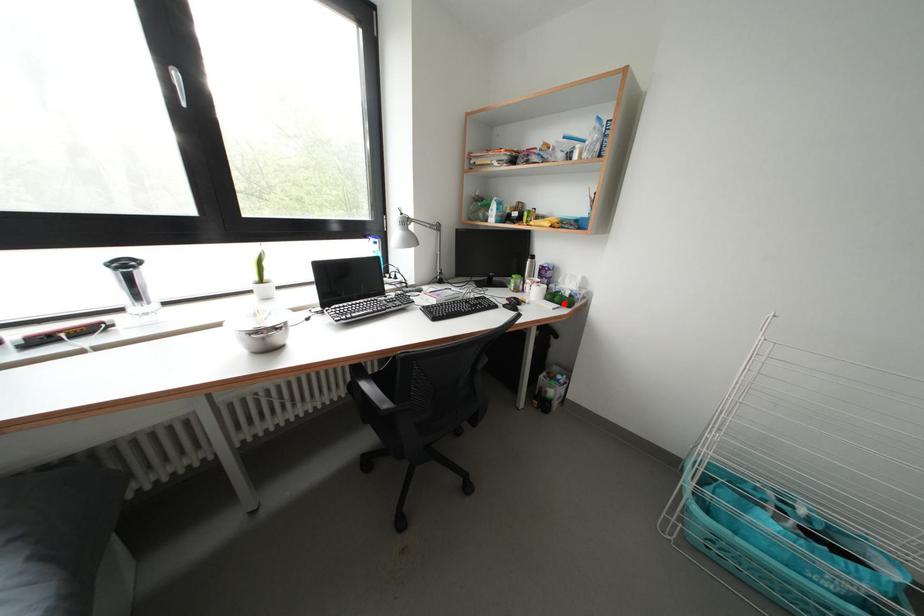
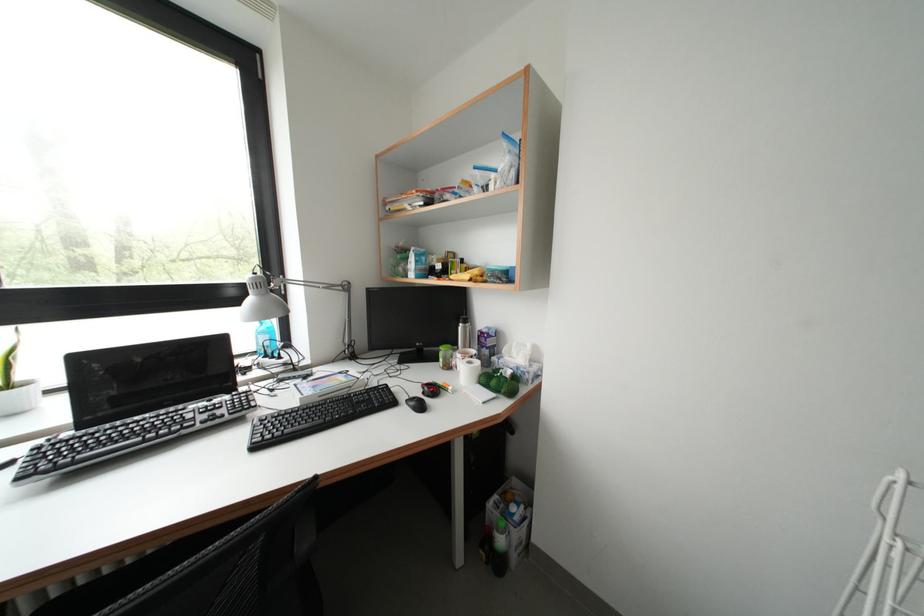
The point at the highlighted location is marked in the first image. Where is the corresponding point in the second image?

(500, 387)